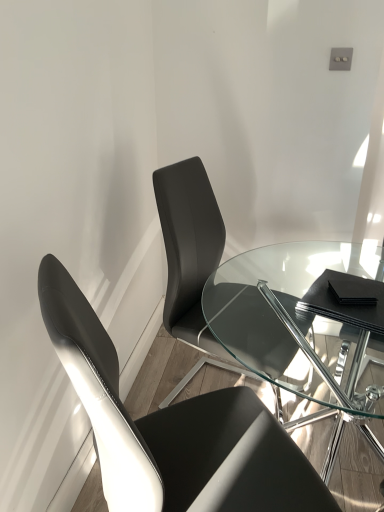
Question: Can you confirm if black leather chair at left, the first chair viewed from the front, is shorter than matte black chair at center, positioned as the 1th chair in back-to-front order?

Choices:
 (A) yes
 (B) no

Answer: (B)

Question: Does black leather chair at left, the 2th chair viewed from the back, have a lesser width compared to matte black chair at center, acting as the 2th chair starting from the front?

Choices:
 (A) no
 (B) yes

Answer: (A)

Question: Is black leather chair at left, the first chair viewed from the front, far from matte black chair at center, positioned as the 1th chair in back-to-front order?

Choices:
 (A) yes
 (B) no

Answer: (B)

Question: Is black leather chair at left, the 2th chair viewed from the back, outside matte black chair at center, positioned as the 1th chair in back-to-front order?

Choices:
 (A) no
 (B) yes

Answer: (B)

Question: From a real-world perspective, is black leather chair at left, the first chair viewed from the front, positioned under matte black chair at center, positioned as the 1th chair in back-to-front order, based on gravity?

Choices:
 (A) yes
 (B) no

Answer: (A)

Question: Does black leather chair at left, the 2th chair viewed from the back, have a greater width compared to matte black chair at center, positioned as the 1th chair in back-to-front order?

Choices:
 (A) yes
 (B) no

Answer: (A)

Question: Does transparent glass table at center have a smaller size compared to matte black chair at center, positioned as the 1th chair in back-to-front order?

Choices:
 (A) no
 (B) yes

Answer: (A)

Question: From a real-world perspective, does transparent glass table at center sit lower than matte black chair at center, acting as the 2th chair starting from the front?

Choices:
 (A) yes
 (B) no

Answer: (A)

Question: Can we say transparent glass table at center lies outside matte black chair at center, acting as the 2th chair starting from the front?

Choices:
 (A) yes
 (B) no

Answer: (A)

Question: Could you tell me if transparent glass table at center is facing matte black chair at center, positioned as the 1th chair in back-to-front order?

Choices:
 (A) yes
 (B) no

Answer: (B)

Question: Does transparent glass table at center have a greater width compared to matte black chair at center, acting as the 2th chair starting from the front?

Choices:
 (A) yes
 (B) no

Answer: (A)

Question: Considering the relative sizes of transparent glass table at center and matte black chair at center, acting as the 2th chair starting from the front, in the image provided, is transparent glass table at center taller than matte black chair at center, acting as the 2th chair starting from the front,?

Choices:
 (A) no
 (B) yes

Answer: (A)

Question: Can you confirm if matte black chair at center, acting as the 2th chair starting from the front, is thinner than black leather chair at left, the first chair viewed from the front?

Choices:
 (A) no
 (B) yes

Answer: (B)